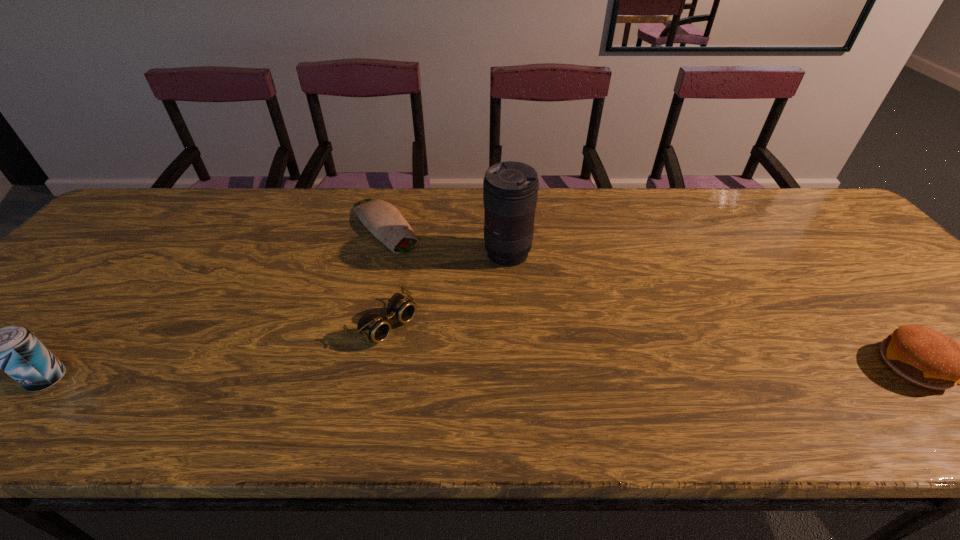
At what (x,y) coordinates should I click in order to perform the action: click on free space between the telephoto lens and the burrito. Please return your answer as a coordinate pair (x, y). The image size is (960, 540). Looking at the image, I should click on 445,240.

Locate an element on the screen. vacant point located between the burrito and the leftmost object is located at coordinates (216, 302).

You are a GUI agent. You are given a task and a screenshot of the screen. Output one action in this format:
    pyautogui.click(x=<x>, y=<y>)
    Task: Click on the second closest object relative to the rightmost object
    
    Given the screenshot: What is the action you would take?
    pyautogui.click(x=373, y=326)

What are the coordinates of `the second closest object to the goggles` in the screenshot? It's located at (510, 189).

This screenshot has height=540, width=960. In order to click on free location that satisfies the following two spatial constraints: 1. on the back side of the second shortest object; 2. on the left side of the second tallest object in this screenshot , I will do `click(96, 322)`.